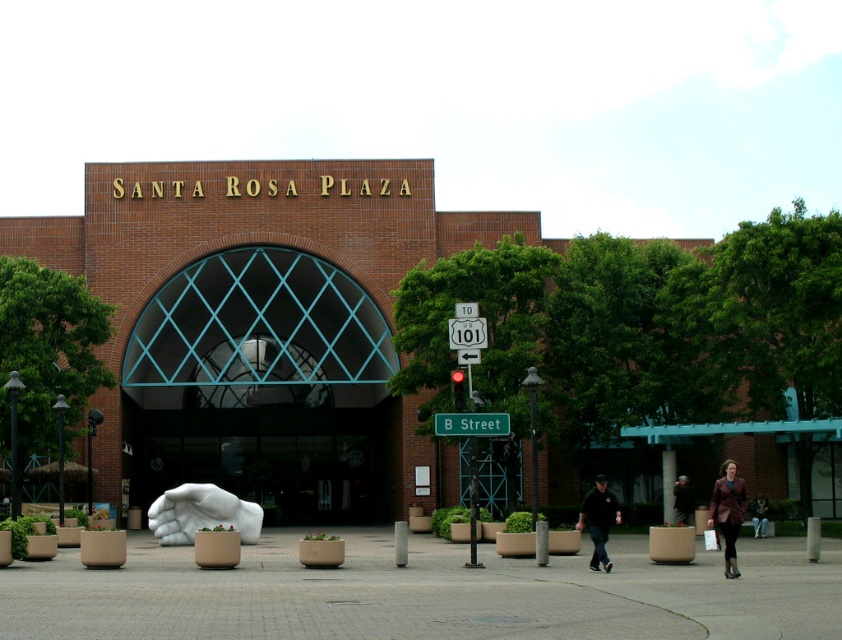
Is white marble sculpture at center shorter than dark blue shirt at center?

No, white marble sculpture at center is not shorter than dark blue shirt at center.

Is white marble sculpture at center to the right of dark blue shirt at center from the viewer's perspective?

Indeed, white marble sculpture at center is positioned on the right side of dark blue shirt at center.

Between point (480, 305) and point (577, 525), which one is positioned in front?

Point (577, 525)

What are the coordinates of `white marble sculpture at center` in the screenshot? It's located at (412, 324).

Can you confirm if smooth concrete pavement at center is shorter than dark brown leather jacket at center?

No, smooth concrete pavement at center is not shorter than dark brown leather jacket at center.

Does smooth concrete pavement at center appear on the right side of dark brown leather jacket at center?

Incorrect, smooth concrete pavement at center is not on the right side of dark brown leather jacket at center.

Locate an element on the screen. The width and height of the screenshot is (842, 640). smooth concrete pavement at center is located at coordinates (425, 593).

Is dark blue shirt at center bigger than dark brown leather jacket at center?

Indeed, dark blue shirt at center has a larger size compared to dark brown leather jacket at center.

This screenshot has width=842, height=640. In order to click on dark blue shirt at center in this screenshot , I will do `click(598, 518)`.